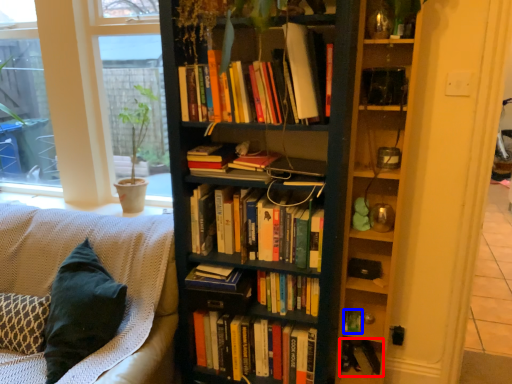
Question: Which object appears closest to the camera in this image, book (highlighted by a red box) or paperback book (highlighted by a blue box)?

Choices:
 (A) book
 (B) paperback book

Answer: (B)